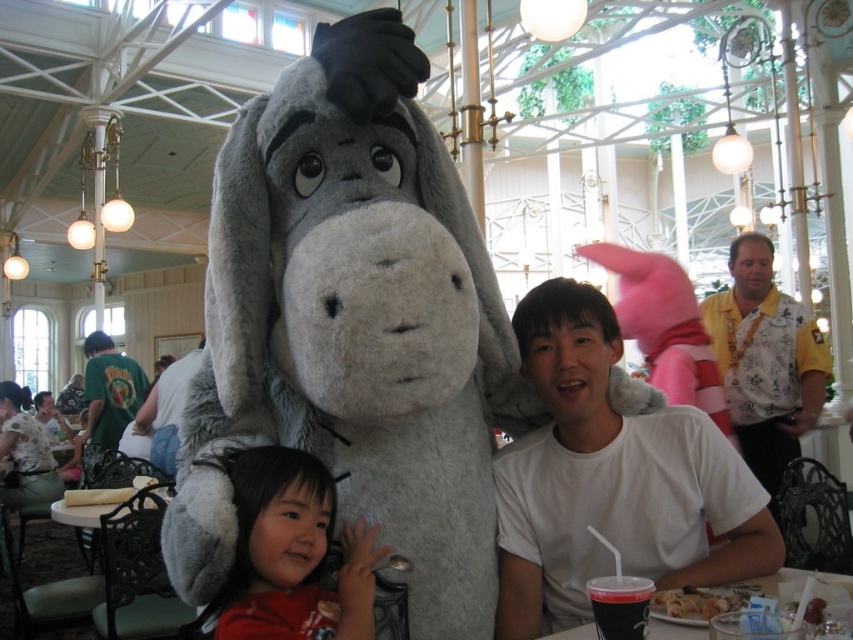
You are a photographer trying to capture a photo of the fluffy gray plush at center and the white cotton shirt at center. Since you want both subjects to appear proportionally sized in your shot, which object should you move closer to the camera?

You should move the white cotton shirt at center closer to the camera because the fluffy gray plush at center is bigger than the white cotton shirt at center, so bringing the smaller one forward will help balance their sizes in the photo.

You are a photographer trying to capture the fluffy gray plush at center and the white cotton shirt at center in the same frame. Based on their positions, which object is blocking the view of the other?

The fluffy gray plush at center is positioned over the white cotton shirt at center, so it is blocking the view of the white cotton shirt at center.